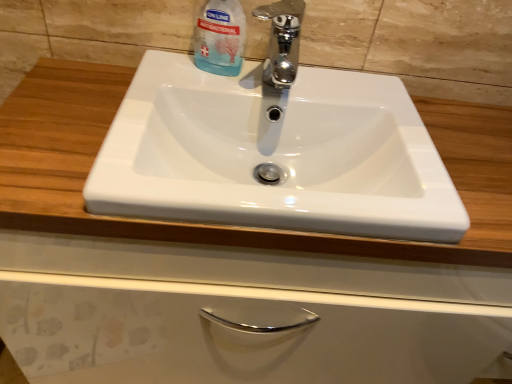
Question: Is chrome metallic faucet at center closer to the viewer compared to transparent plastic bottle at upper center?

Choices:
 (A) yes
 (B) no

Answer: (A)

Question: Is chrome metallic faucet at center at the right side of transparent plastic bottle at upper center?

Choices:
 (A) yes
 (B) no

Answer: (A)

Question: Is there a large distance between chrome metallic faucet at center and transparent plastic bottle at upper center?

Choices:
 (A) yes
 (B) no

Answer: (B)

Question: Considering the relative positions of chrome metallic faucet at center and transparent plastic bottle at upper center in the image provided, is chrome metallic faucet at center behind transparent plastic bottle at upper center?

Choices:
 (A) no
 (B) yes

Answer: (A)

Question: Is chrome metallic faucet at center with transparent plastic bottle at upper center?

Choices:
 (A) no
 (B) yes

Answer: (B)

Question: Considering the positions of point tap(228, 13) and point tap(389, 180), is point tap(228, 13) closer or farther from the camera than point tap(389, 180)?

Choices:
 (A) closer
 (B) farther

Answer: (B)

Question: Is transparent plastic bottle at upper center inside the boundaries of white glossy sink at center, or outside?

Choices:
 (A) outside
 (B) inside

Answer: (A)

Question: In terms of height, does transparent plastic bottle at upper center look taller or shorter compared to white glossy sink at center?

Choices:
 (A) tall
 (B) short

Answer: (A)

Question: From a real-world perspective, is transparent plastic bottle at upper center physically located above or below white glossy sink at center?

Choices:
 (A) above
 (B) below

Answer: (A)

Question: From the image's perspective, relative to chrome metallic faucet at center, is transparent plastic bottle at upper center above or below?

Choices:
 (A) below
 (B) above

Answer: (B)

Question: Considering the relative positions of transparent plastic bottle at upper center and chrome metallic faucet at center in the image provided, is transparent plastic bottle at upper center to the left or to the right of chrome metallic faucet at center?

Choices:
 (A) right
 (B) left

Answer: (B)

Question: In terms of height, does transparent plastic bottle at upper center look taller or shorter compared to chrome metallic faucet at center?

Choices:
 (A) short
 (B) tall

Answer: (B)

Question: Looking at the image, does transparent plastic bottle at upper center seem bigger or smaller compared to chrome metallic faucet at center?

Choices:
 (A) small
 (B) big

Answer: (A)

Question: Considering the relative positions of chrome metallic faucet at center and transparent plastic bottle at upper center in the image provided, is chrome metallic faucet at center to the left or to the right of transparent plastic bottle at upper center?

Choices:
 (A) left
 (B) right

Answer: (B)

Question: From the image's perspective, is chrome metallic faucet at center located above or below transparent plastic bottle at upper center?

Choices:
 (A) above
 (B) below

Answer: (B)